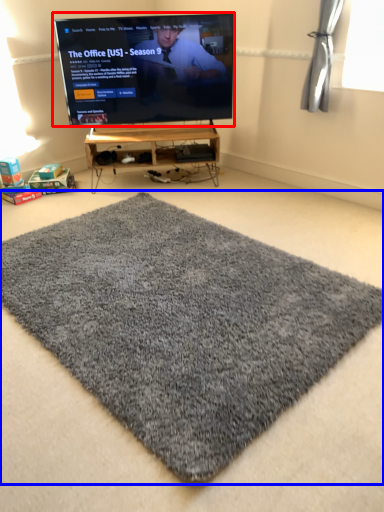
Question: Which point is further to the camera, television (highlighted by a red box) or mat (highlighted by a blue box)?

Choices:
 (A) television
 (B) mat

Answer: (A)